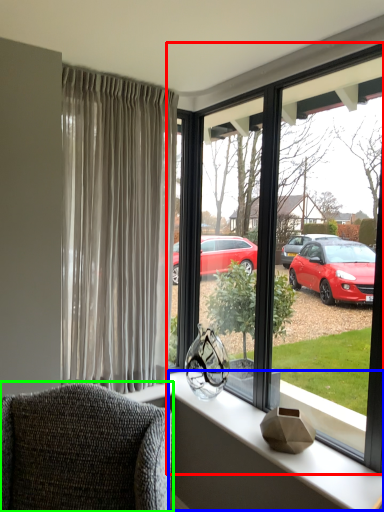
Question: Which object is the farthest from window (highlighted by a red box)? Choose among these: window sill (highlighted by a blue box) or chair (highlighted by a green box).

Choices:
 (A) window sill
 (B) chair

Answer: (B)